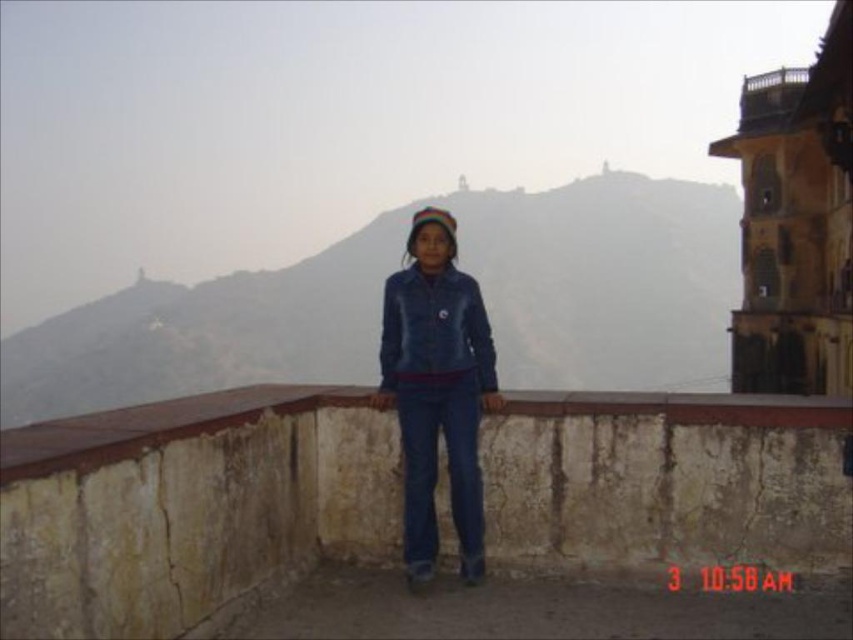
You are a photographer positioned at the camera location. You want to capture a closeup shot of the denim jacket at center. Given that your camera can focus on objects within 50 feet, will you need to adjust your position to get a clear shot?

The denim jacket at center is 52.35 feet away from the camera. Since the camera can only focus within 50 feet, you need to move closer by approximately 2.35 feet to ensure the denim jacket at center is within the focus range.